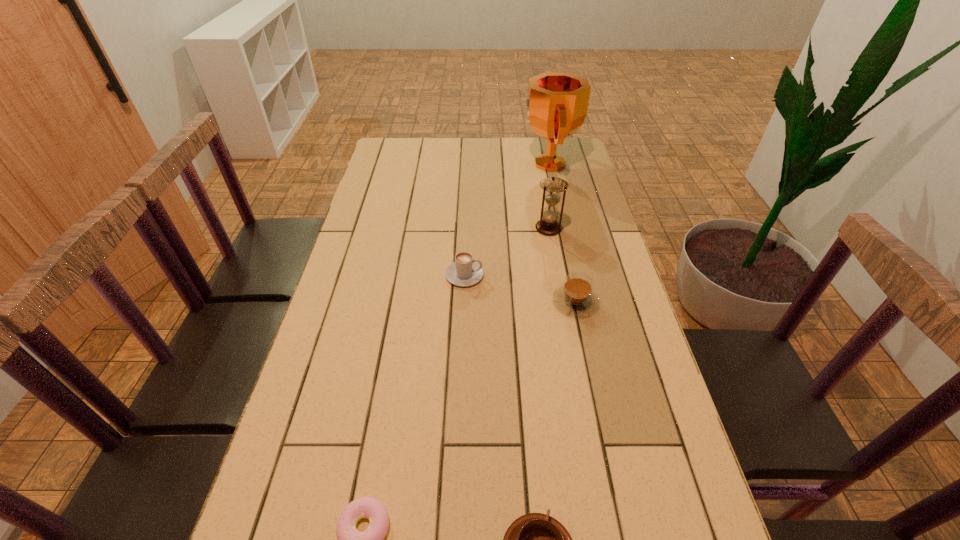
The image size is (960, 540). Identify the location of the tallest object. (556, 106).

Image resolution: width=960 pixels, height=540 pixels. Identify the location of award. (556, 106).

This screenshot has height=540, width=960. Find the location of `the fifth nearest object`. the fifth nearest object is located at coordinates (552, 186).

What are the coordinates of `hourglass` in the screenshot? It's located at (552, 186).

Image resolution: width=960 pixels, height=540 pixels. Find the location of `the rightmost cappuccino`. the rightmost cappuccino is located at coordinates (575, 297).

You are a GUI agent. You are given a task and a screenshot of the screen. Output one action in this format:
    pyautogui.click(x=<x>, y=<y>)
    Task: Click on the fifth object from right to left
    This screenshot has width=960, height=540.
    Given the screenshot: What is the action you would take?
    pyautogui.click(x=465, y=271)

Image resolution: width=960 pixels, height=540 pixels. Find the location of `blank area located 0.160m on the side of the tallest object with the star emblem`. blank area located 0.160m on the side of the tallest object with the star emblem is located at coordinates (481, 164).

Identify the location of vacant space located on the side of the tallest object with the star emblem. The width and height of the screenshot is (960, 540). (461, 164).

Find the location of a particular element. This screenshot has height=540, width=960. vacant region located 0.260m on the side of the tallest object with the star emblem is located at coordinates (455, 164).

This screenshot has width=960, height=540. In order to click on vacant region located on the back of the hourglass in this screenshot , I will do `click(540, 181)`.